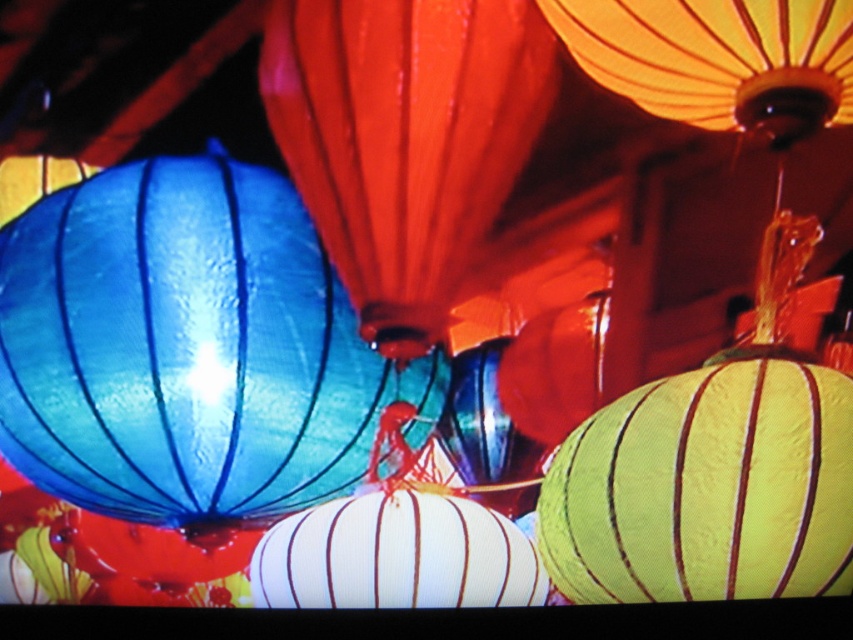
Does matte orange paper lantern at center lie in front of matte orange paper lantern at upper right?

No.

Does matte orange paper lantern at center have a greater height compared to matte orange paper lantern at upper right?

Correct, matte orange paper lantern at center is much taller as matte orange paper lantern at upper right.

Image resolution: width=853 pixels, height=640 pixels. Describe the element at coordinates (404, 140) in the screenshot. I see `matte orange paper lantern at center` at that location.

Locate an element on the screen. The height and width of the screenshot is (640, 853). matte orange paper lantern at center is located at coordinates (404, 140).

Is point (354, 387) more distant than point (416, 93)?

Yes, it is behind point (416, 93).

Based on the photo, between matte blue paper lantern at left and matte orange paper lantern at center, which one is positioned lower?

matte blue paper lantern at left is lower down.

Between point (259, 509) and point (524, 67), which one is positioned behind?

Positioned behind is point (259, 509).

Where is `matte blue paper lantern at left`? matte blue paper lantern at left is located at coordinates (187, 348).

Does matte yellow paper lantern at lower right appear on the left side of matte orange paper lantern at upper right?

No, matte yellow paper lantern at lower right is not to the left of matte orange paper lantern at upper right.

Does matte yellow paper lantern at lower right have a lesser height compared to matte orange paper lantern at upper right?

In fact, matte yellow paper lantern at lower right may be taller than matte orange paper lantern at upper right.

Image resolution: width=853 pixels, height=640 pixels. Find the location of `matte yellow paper lantern at lower right`. matte yellow paper lantern at lower right is located at coordinates (705, 488).

Find the location of a particular element. This screenshot has width=853, height=640. matte yellow paper lantern at lower right is located at coordinates (705, 488).